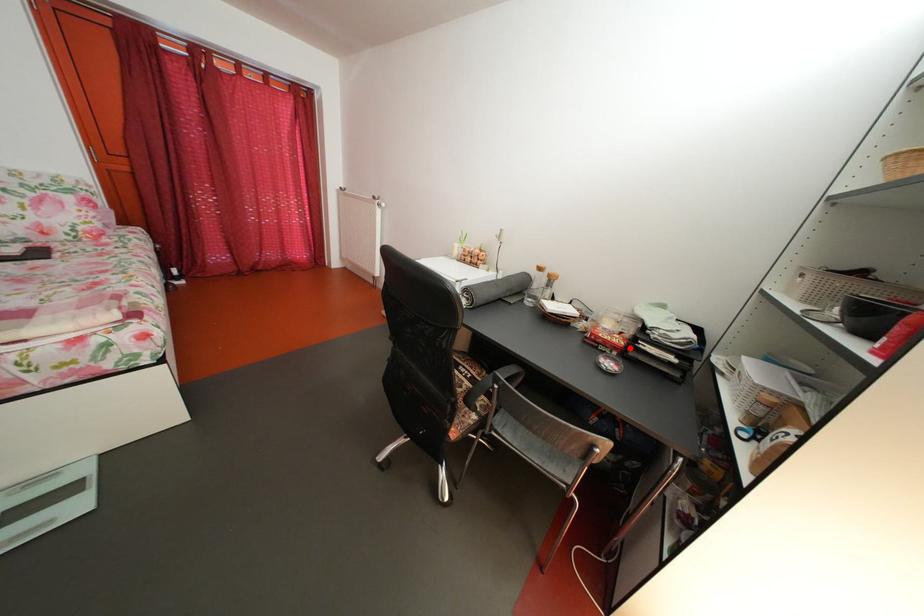
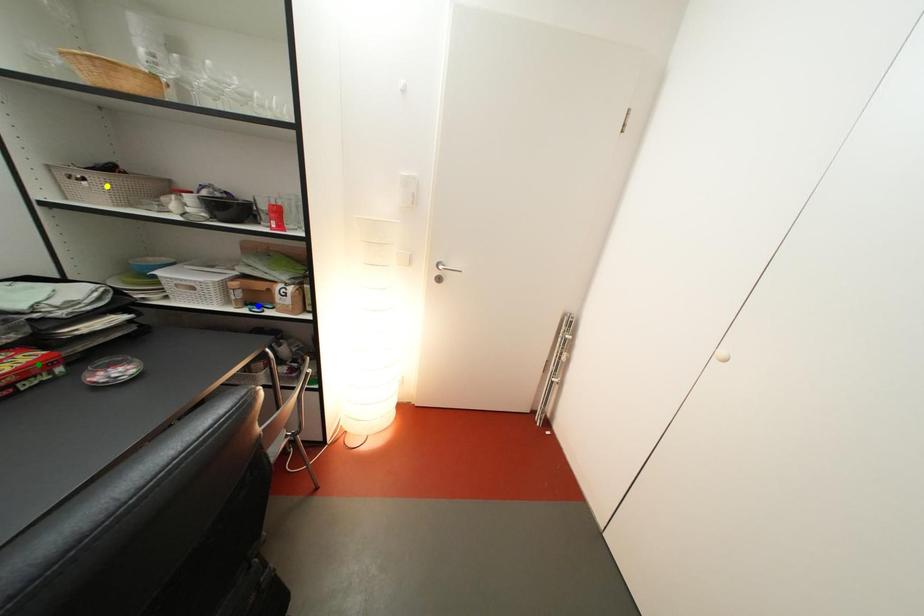
Question: I am providing you with two images of the same scene from different viewpoints. A red point is marked on the first image. You are given multiple points on the second image. Which point in image 2 is actually the same real-world point as the red point in image 1?

Choices:
 (A) yellow point
 (B) blue point
 (C) green point

Answer: (C)